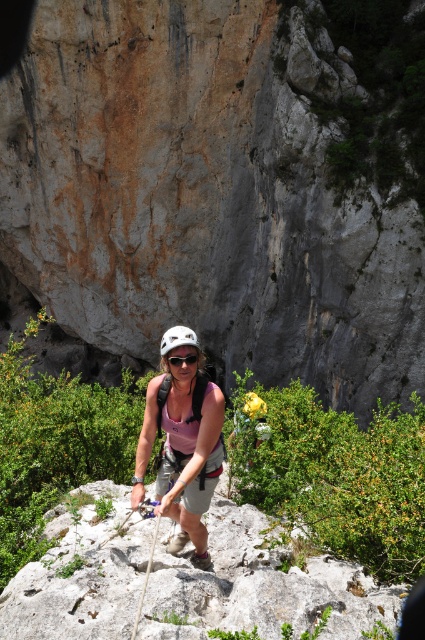
From the picture: You are a climber standing at the base of the cliff. You see a point marked at coordinates point (107, 99). If your climbing rope is 90 feet long, can you reach that point with your rope?

The point (107, 99) is 89.66 feet away from you. Since your rope is 90 feet long, you can just barely reach it.

You are a rock climber preparing to secure your gear. You have two helmets in your inventory, the pink fabric helmet at center and the white matte helmet at center. Which helmet would you choose if you need a wider one for better head protection?

The white matte helmet at center has a greater width than the pink fabric helmet at center, so you should choose the white matte helmet at center for better head protection due to its wider size.